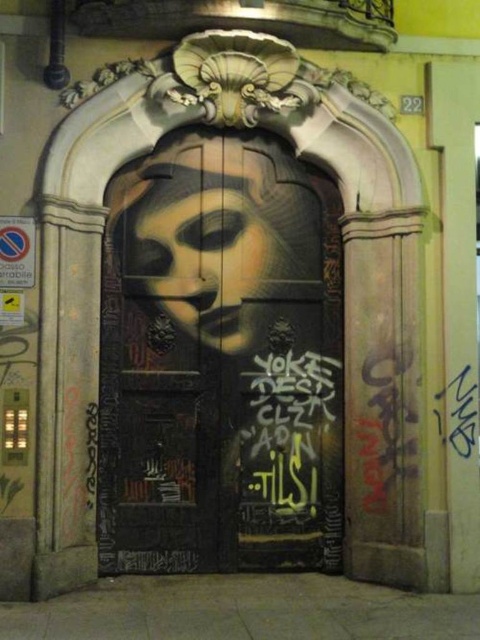
Question: Which of the following is the farthest from the observer?

Choices:
 (A) matte black door at center
 (B) black graffiti at center

Answer: (A)

Question: Which object is closer to the camera taking this photo?

Choices:
 (A) matte black door at center
 (B) black graffiti at center

Answer: (B)

Question: Does matte black door at center appear over black graffiti at center?

Choices:
 (A) yes
 (B) no

Answer: (A)

Question: Does matte black door at center appear over black graffiti at center?

Choices:
 (A) yes
 (B) no

Answer: (A)

Question: Which object is closer to the camera taking this photo?

Choices:
 (A) black graffiti at center
 (B) matte black door at center

Answer: (A)

Question: Is matte black door at center further to camera compared to black graffiti at center?

Choices:
 (A) no
 (B) yes

Answer: (B)